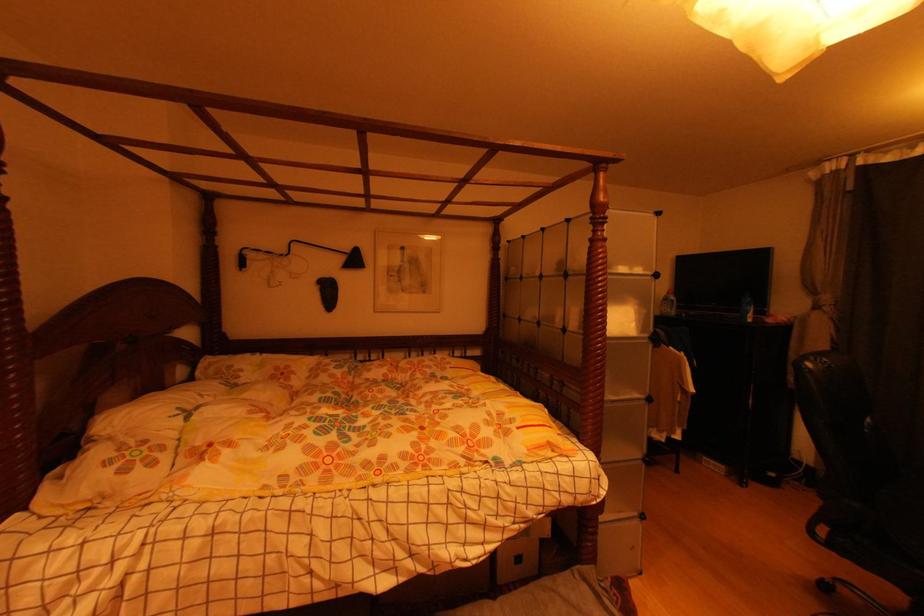
Locate an element on the screen. storage cube handle is located at coordinates (517, 560).